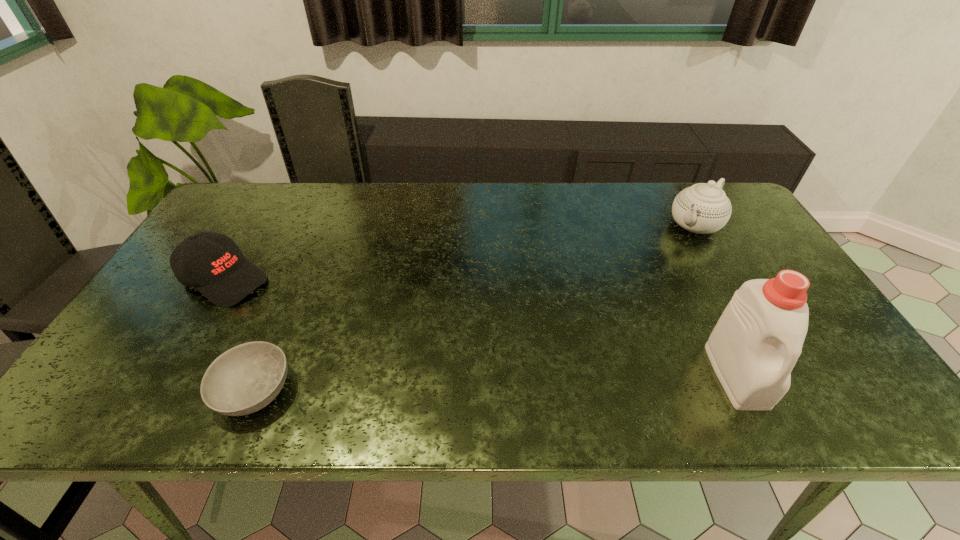
Where is `free space between the tallest object and the leftmost object`? The image size is (960, 540). free space between the tallest object and the leftmost object is located at coordinates (481, 327).

I want to click on free space that is in between the leftmost object and the chinaware, so click(x=460, y=252).

You are a GUI agent. You are given a task and a screenshot of the screen. Output one action in this format:
    pyautogui.click(x=<x>, y=<y>)
    Task: Click on the free point between the shortest object and the tallest object
    This screenshot has width=960, height=540.
    Given the screenshot: What is the action you would take?
    pyautogui.click(x=495, y=383)

In order to click on free spot between the third object from right to left and the second farthest object in this screenshot , I will do `click(240, 335)`.

Locate an element on the screen. The image size is (960, 540). object that is the third closest to the shortest object is located at coordinates (703, 208).

Choose which object is the second nearest neighbor to the baseball cap. Please provide its 2D coordinates. Your answer should be formatted as a tuple, i.e. [(x, y)], where the tuple contains the x and y coordinates of a point satisfying the conditions above.

[(753, 348)]